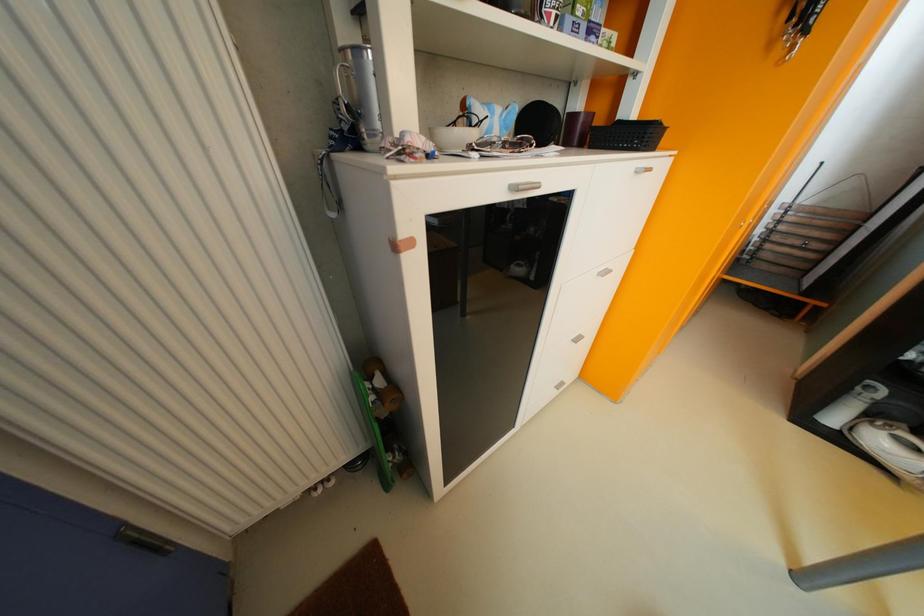
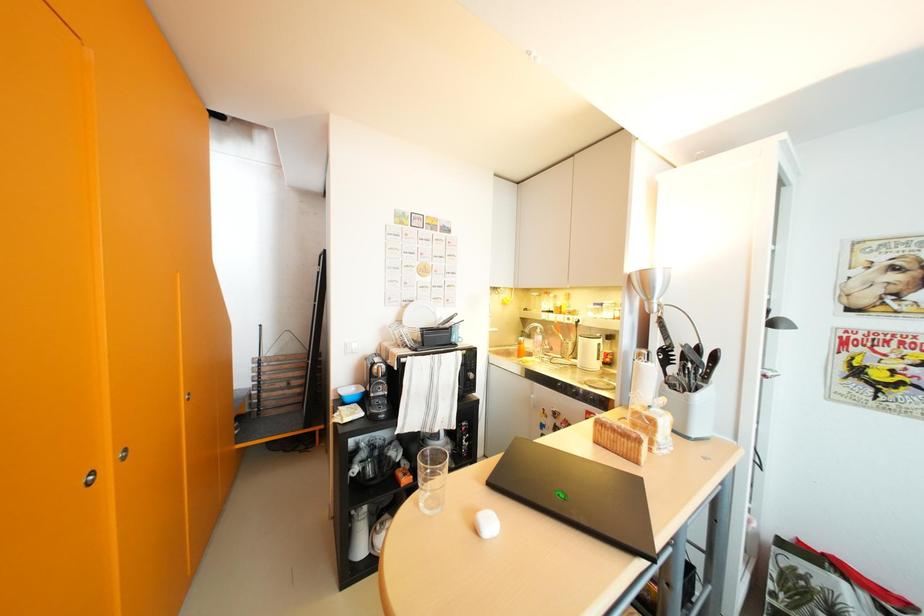
Question: The first image is from the beginning of the video and the second image is from the end. How did the camera likely rotate when shooting the video?

Choices:
 (A) Left
 (B) Right
 (C) Up
 (D) Down

Answer: (B)